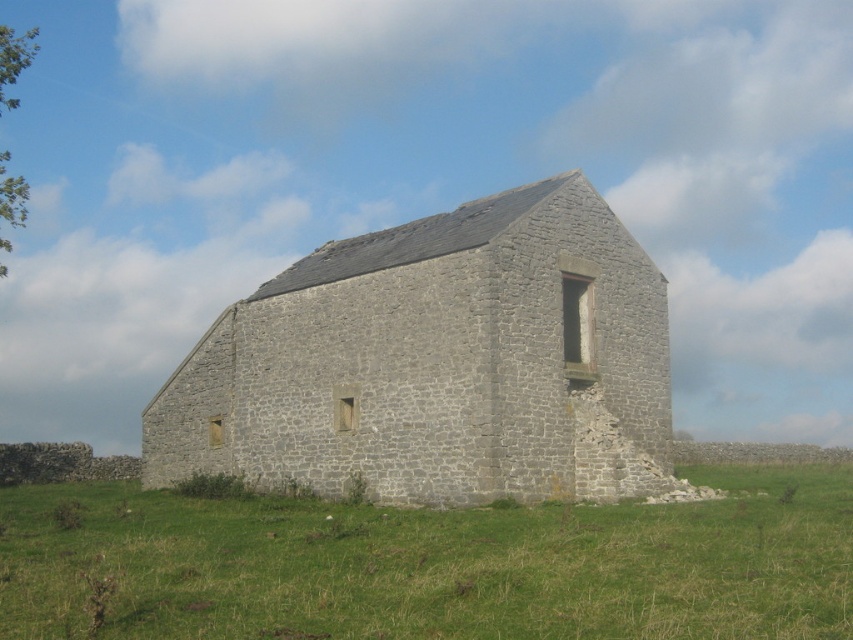
Does gray stone church at center have a smaller size compared to green grass at lower center?

Incorrect, gray stone church at center is not smaller in size than green grass at lower center.

Who is more forward, [645,468] or [401,536]?

Point [401,536] is more forward.

Find the location of a particular element. gray stone church at center is located at coordinates (439, 362).